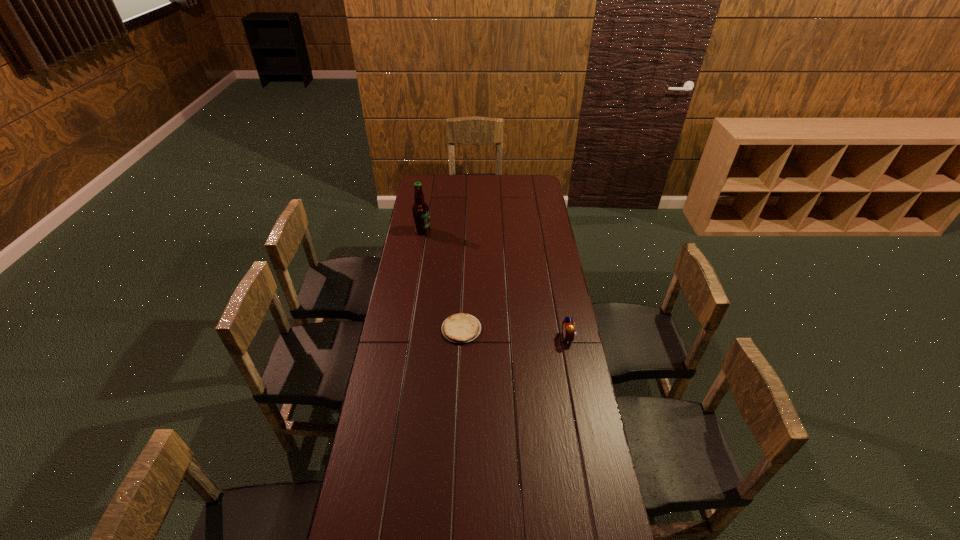
Select which object is the second closest to the tortilla. Please provide its 2D coordinates. Your answer should be formatted as a tuple, i.e. [(x, y)], where the tuple contains the x and y coordinates of a point satisfying the conditions above.

[(420, 210)]

The height and width of the screenshot is (540, 960). In order to click on object that can be found as the closest to the tallest object in this screenshot , I will do `click(460, 328)`.

I want to click on free space that satisfies the following two spatial constraints: 1. on the label of the second object from left to right; 2. on the right side of the leftmost object, so click(x=407, y=329).

Where is `free spot that satisfies the following two spatial constraints: 1. on the label of the tallest object; 2. on the left side of the tortilla`? This screenshot has width=960, height=540. free spot that satisfies the following two spatial constraints: 1. on the label of the tallest object; 2. on the left side of the tortilla is located at coordinates (407, 329).

Identify the location of free location that satisfies the following two spatial constraints: 1. on the label of the farthest object; 2. on the left side of the second object from left to right. (407, 329).

The width and height of the screenshot is (960, 540). I want to click on vacant area in the image that satisfies the following two spatial constraints: 1. on the label of the beer bottle; 2. on the right side of the tortilla, so click(x=407, y=329).